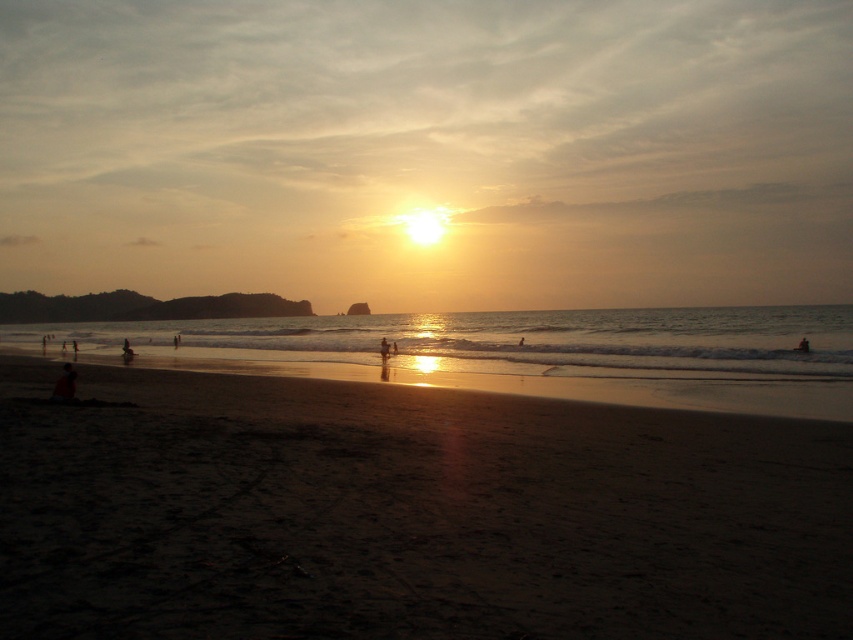
You are a photographer standing at the edge of the beach and want to take a photo that includes both the matte black person at lower left and the dark skin human at center. Based on their positions, which person is closer to the right side of the photo frame?

The matte black person at lower left is positioned on the right side of dark skin human at center, so the matte black person at lower left is closer to the right side of the photo frame.

You are standing on the beach and see the matte black person at lower left and the dark skin human at center. Which person is nearer to you?

The matte black person at lower left is closer to the viewer than the dark skin human at center.